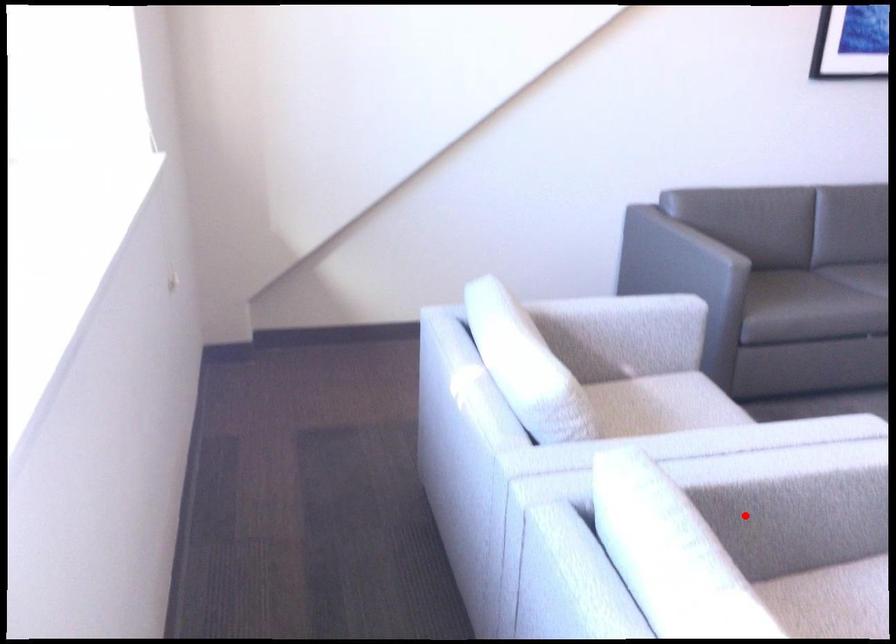
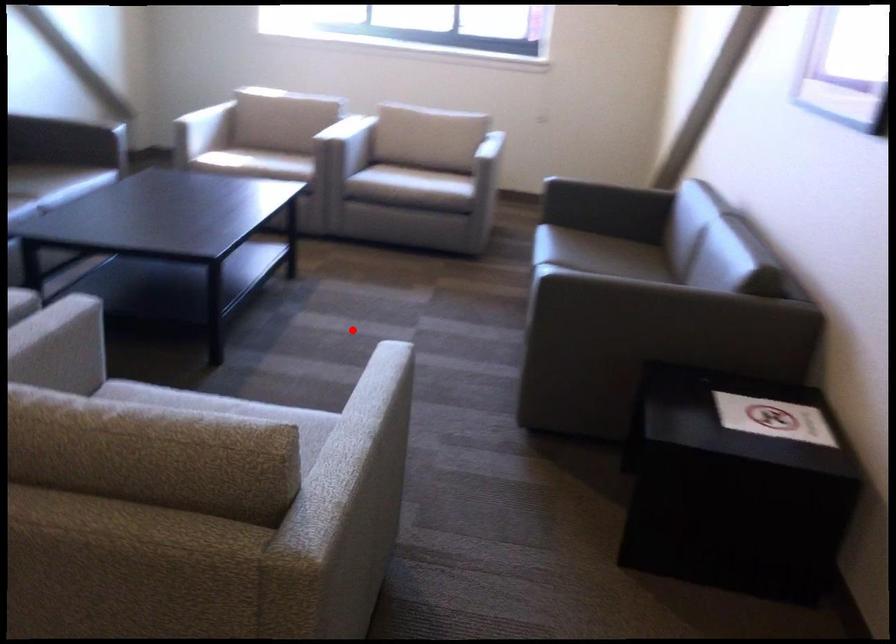
I am providing you with two images of the same scene from different viewpoints. A red point is marked on the first image and another point is marked on the second image. Is the red point in image1 aligned with the point shown in image2?

No